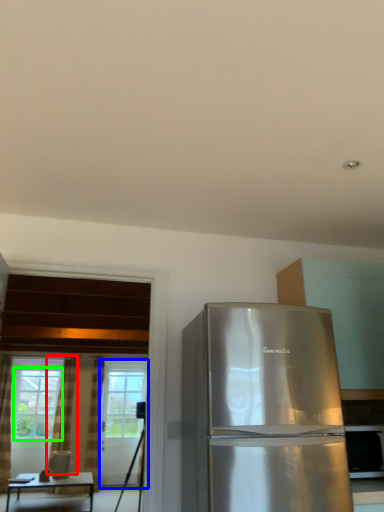
Question: Considering the real-world distances, which object is farthest from curtain (highlighted by a red box)? screen door (highlighted by a blue box) or window (highlighted by a green box)?

Choices:
 (A) screen door
 (B) window

Answer: (A)